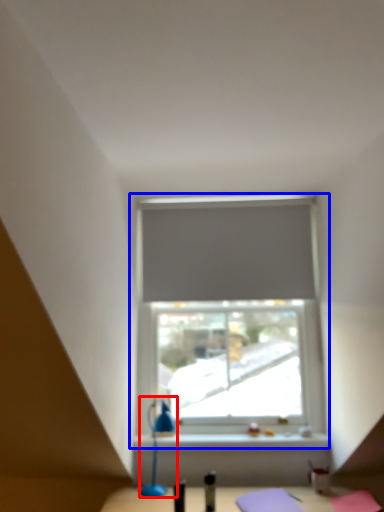
Question: Which point is further to the camera, table lamp (highlighted by a red box) or window (highlighted by a blue box)?

Choices:
 (A) table lamp
 (B) window

Answer: (B)